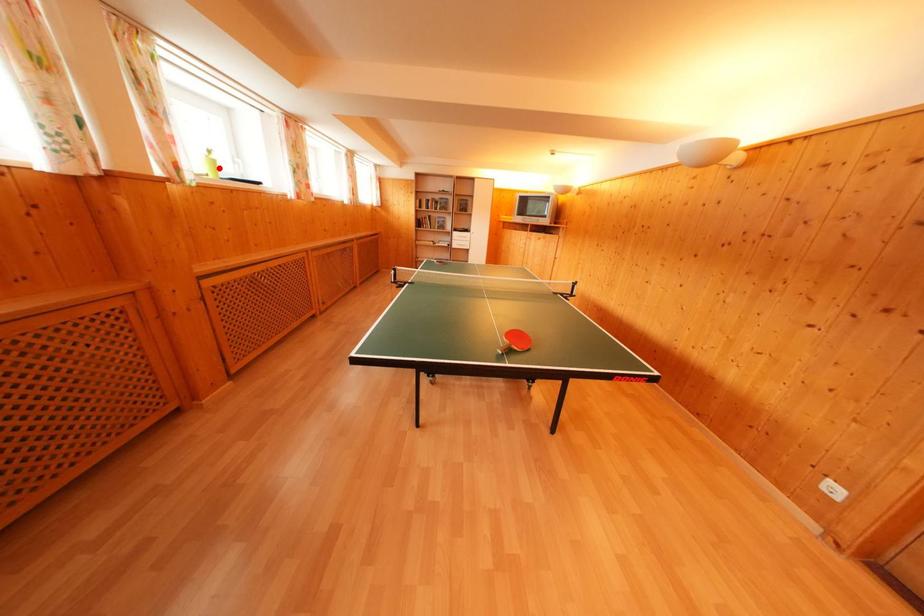
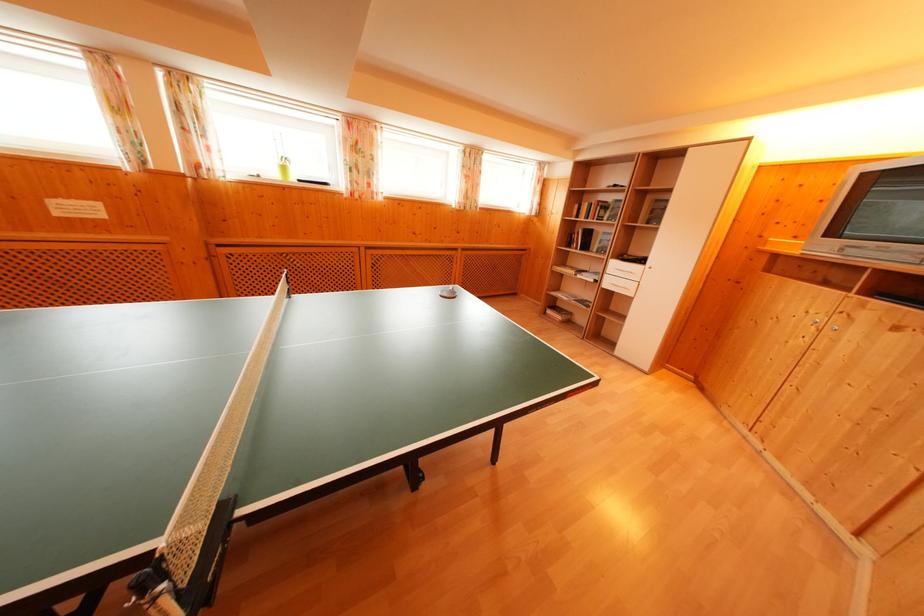
The point at the highlighted location is marked in the first image. Where is the corresponding point in the second image?

(288, 174)